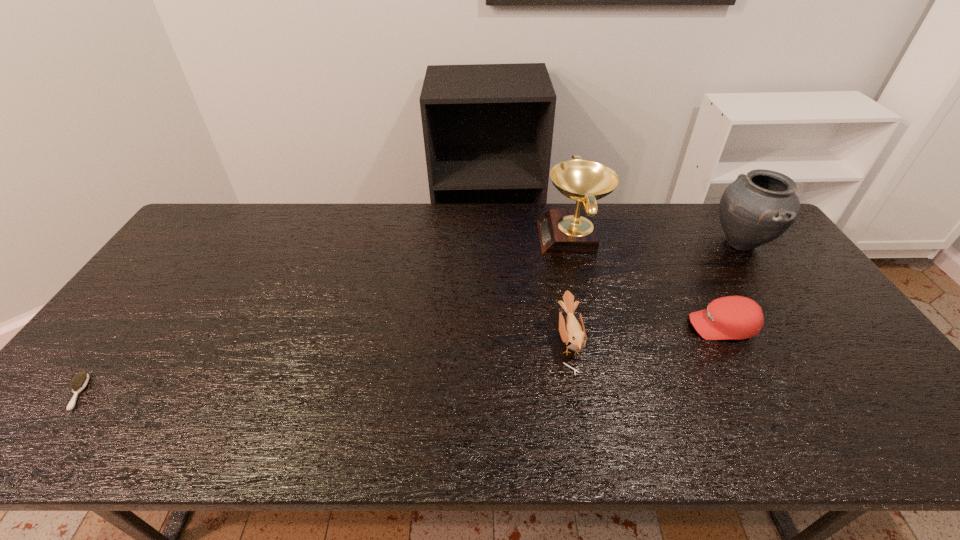
You are a GUI agent. You are given a task and a screenshot of the screen. Output one action in this format:
    pyautogui.click(x=<x>, y=<y>)
    Task: Click on the award
    The height and width of the screenshot is (540, 960).
    Given the screenshot: What is the action you would take?
    pyautogui.click(x=562, y=231)

Find the location of a particular element. urn is located at coordinates (757, 208).

Locate an element on the screen. This screenshot has width=960, height=540. bird is located at coordinates (572, 333).

In order to click on the second shortest object in this screenshot , I will do `click(732, 317)`.

Identify the location of the fourth object from left to right. The image size is (960, 540). (732, 317).

Where is `the shortest object`? the shortest object is located at coordinates (80, 381).

Locate an element on the screen. This screenshot has height=540, width=960. the leftmost object is located at coordinates (80, 381).

The width and height of the screenshot is (960, 540). What are the coordinates of `free space located on the front-facing side of the award` in the screenshot? It's located at (465, 238).

Locate an element on the screen. This screenshot has height=540, width=960. vacant space situated on the front-facing side of the award is located at coordinates (477, 238).

In order to click on vacant space located on the front-facing side of the award in this screenshot , I will do `click(432, 238)`.